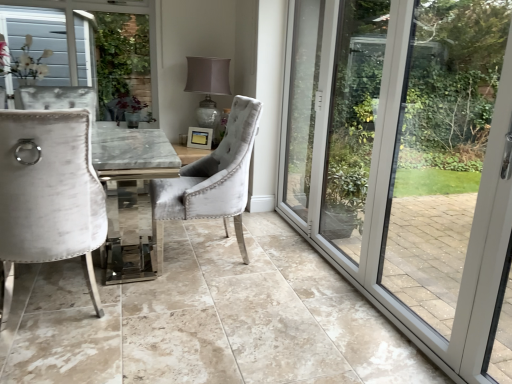
Question: Is point (53, 38) positioned closer to the camera than point (246, 175)?

Choices:
 (A) closer
 (B) farther

Answer: (B)

Question: Is white textured fabric at upper left taller or shorter than velvet grey chair at center, which is counted as the first chair, starting from the right?

Choices:
 (A) tall
 (B) short

Answer: (B)

Question: Which object is positioned closest to the transparent glass door at right?

Choices:
 (A) velvet white chair at left, placed as the 1th chair when sorted from left to right
 (B) matte silver lamp at center
 (C) velvet grey chair at center, acting as the second chair starting from the left
 (D) white textured fabric at upper left

Answer: (C)

Question: Which object is positioned closest to the velvet white chair at left, acting as the second chair starting from the right?

Choices:
 (A) matte silver lamp at center
 (B) transparent glass door at right
 (C) white textured fabric at upper left
 (D) velvet grey chair at center, acting as the second chair starting from the left

Answer: (D)